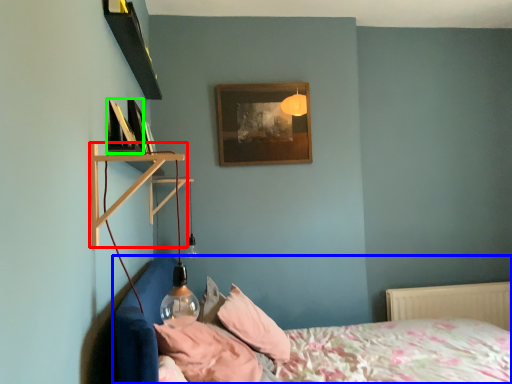
Question: Based on their relative distances, which object is farther from shelf (highlighted by a red box)? Choose from bed (highlighted by a blue box) and picture frame (highlighted by a green box).

Choices:
 (A) bed
 (B) picture frame

Answer: (A)